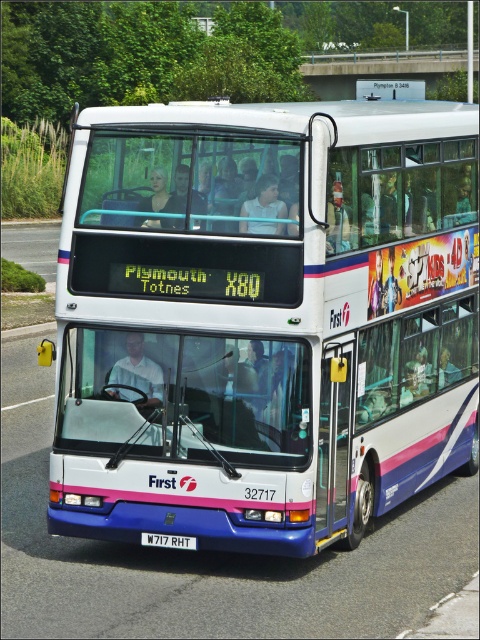
Who is positioned more to the left, white glossy decker bus at center or asphalt road at left?

asphalt road at left

This screenshot has height=640, width=480. I want to click on white glossy decker bus at center, so click(x=264, y=320).

Is point (55, 248) behind point (145, 532)?

Yes.

Can you confirm if asphalt road at left is positioned to the left of white plastic license plate at center?

Correct, you'll find asphalt road at left to the left of white plastic license plate at center.

Is point (22, 241) positioned before point (157, 540)?

No, it is behind (157, 540).

Identify the location of asphalt road at left. Image resolution: width=480 pixels, height=640 pixels. (32, 244).

Does point (190, 458) come closer to viewer compared to point (158, 545)?

Yes.

Who is more forward, (196, 326) or (190, 545)?

Positioned in front is point (196, 326).

Image resolution: width=480 pixels, height=640 pixels. Find the location of `white glossy decker bus at center`. white glossy decker bus at center is located at coordinates (264, 320).